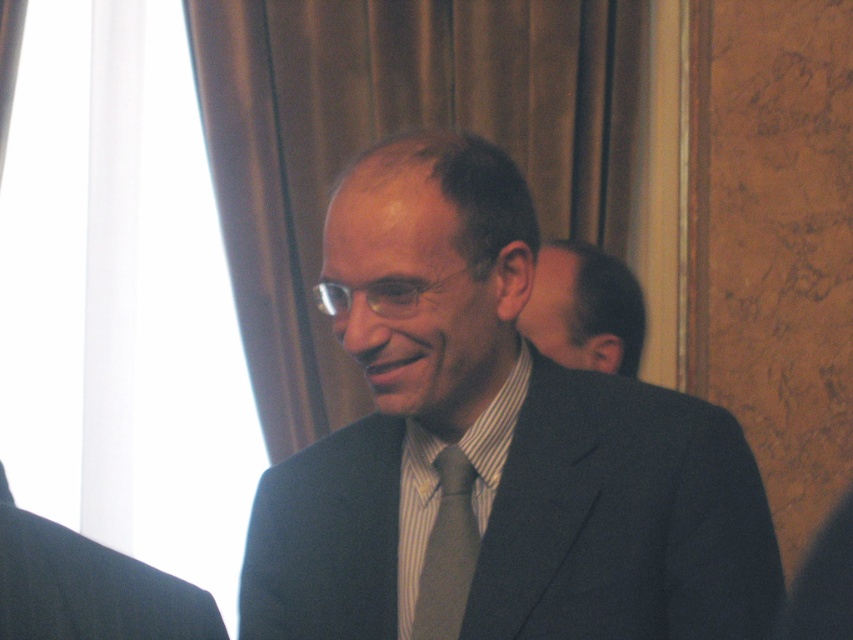
Question: Is smooth black hair at right positioned behind gray striped tie at center?

Choices:
 (A) no
 (B) yes

Answer: (B)

Question: Is brown fabric curtain at left below gray striped tie at center?

Choices:
 (A) no
 (B) yes

Answer: (A)

Question: Which object appears farthest from the camera in this image?

Choices:
 (A) gray striped tie at center
 (B) dark gray suit at center
 (C) smooth black hair at right

Answer: (C)

Question: Does smooth black hair at right have a lesser width compared to gray striped tie at center?

Choices:
 (A) yes
 (B) no

Answer: (B)

Question: Which object is positioned farthest from the brown fabric curtain at left?

Choices:
 (A) gray striped tie at center
 (B) dark gray wool suit at left
 (C) smooth black hair at right

Answer: (B)

Question: Estimate the real-world distances between objects in this image. Which object is farther from the brown fabric curtain at left?

Choices:
 (A) smooth black hair at right
 (B) dark gray suit at center
 (C) dark gray wool suit at left

Answer: (C)